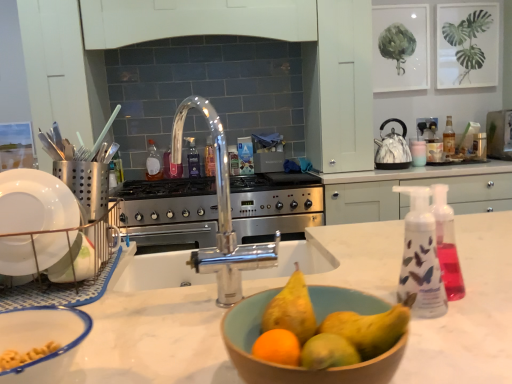
Locate an element on the screen. Image resolution: width=512 pixels, height=384 pixels. vacant area on top of wooden bowl at center, marked as the first basin in a right-to-left arrangement (from a real-world perspective) is located at coordinates (337, 314).